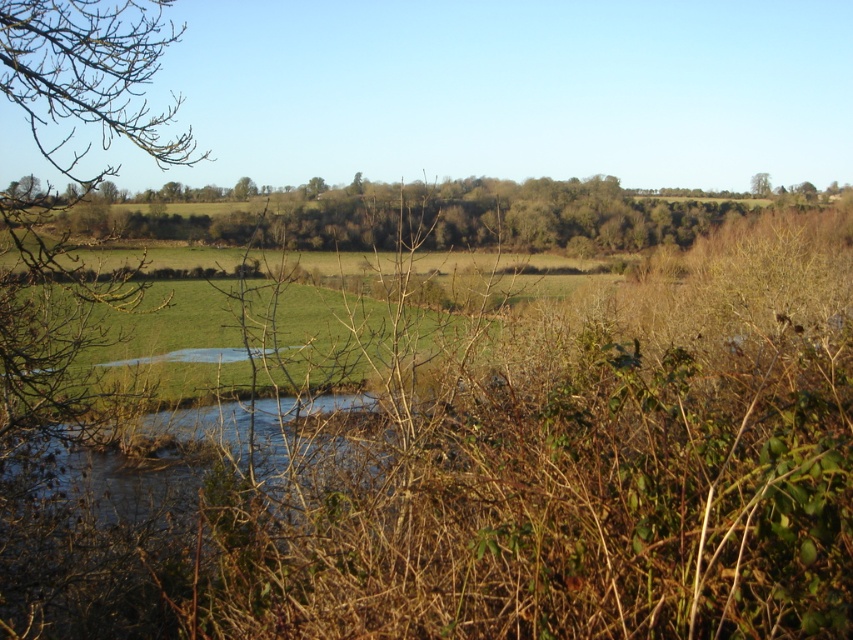
You are standing in the rural landscape and want to take a photo of the serene scene. If you focus your camera on the middle ground, will the bare branches at left be in the foreground or background of your photo?

The bare branches at left are located in the foreground because they are positioned closer to the viewer compared to the middle ground elements.

You are a hiker standing in the middle of the field. You notice the bare branches at left and the brown textured tree at center. Which object is closer to you?

The bare branches at left are closer to you since they are positioned in front of the brown textured tree at center.